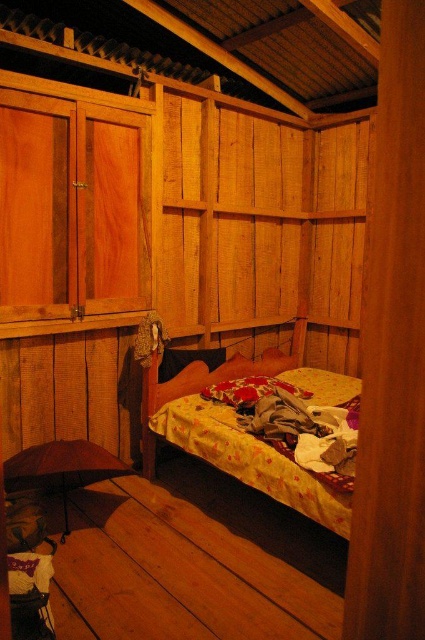
Question: Which point appears closest to the camera in this image?

Choices:
 (A) (224, 360)
 (B) (198, 400)

Answer: (B)

Question: Does yellow floral fabric bed at center have a larger size compared to fluffy fabric pillow at center?

Choices:
 (A) yes
 (B) no

Answer: (A)

Question: Does yellow floral fabric bed at center have a greater width compared to fluffy fabric pillow at center?

Choices:
 (A) no
 (B) yes

Answer: (B)

Question: Which object appears closest to the camera in this image?

Choices:
 (A) black fabric pillow at center
 (B) fluffy fabric pillow at center

Answer: (B)

Question: Can you confirm if yellow floral fabric bed at center is bigger than fluffy fabric pillow at center?

Choices:
 (A) no
 (B) yes

Answer: (B)

Question: Which point is closer to the camera?

Choices:
 (A) yellow floral fabric bed at center
 (B) black fabric pillow at center
 (C) fluffy fabric pillow at center

Answer: (A)